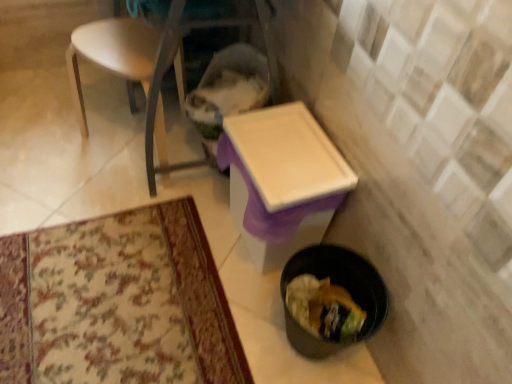
This screenshot has width=512, height=384. I want to click on free point below white plastic chair at upper left (from a real-world perspective), so click(x=115, y=147).